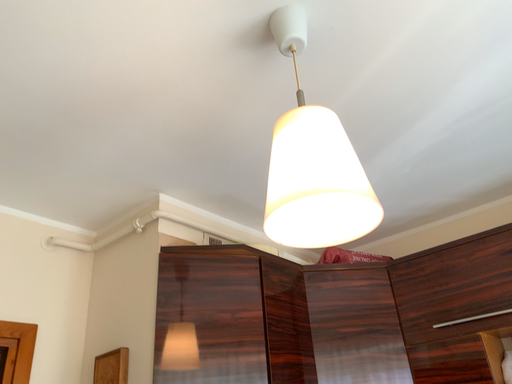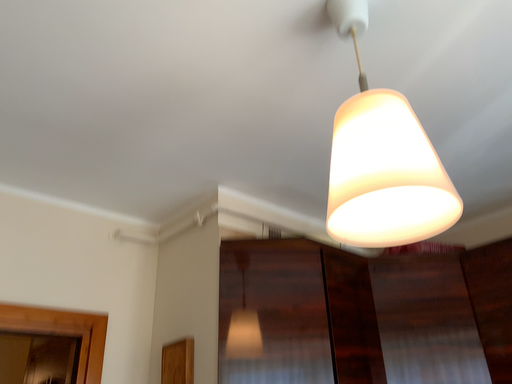
Question: How did the camera likely rotate when shooting the video?

Choices:
 (A) rotated left
 (B) rotated right

Answer: (A)